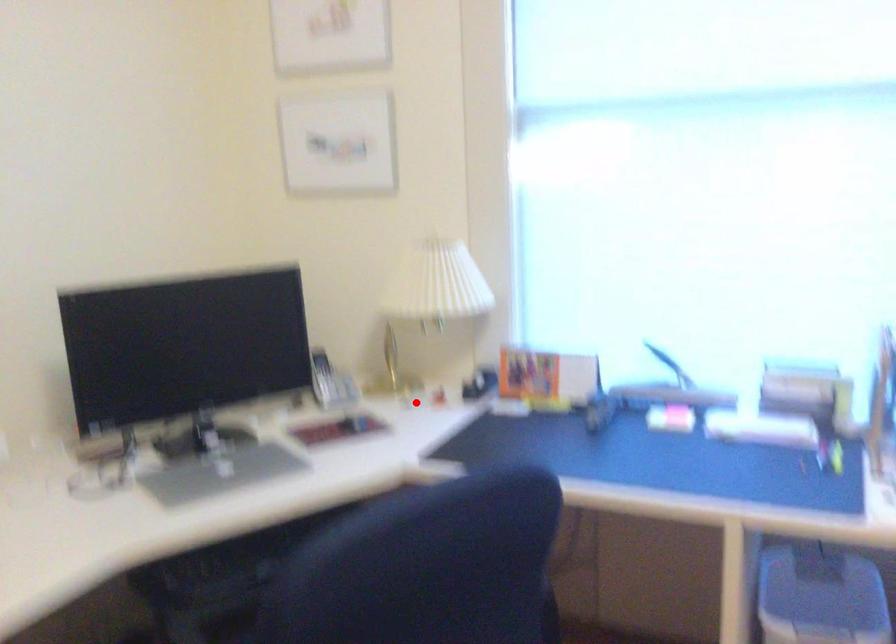
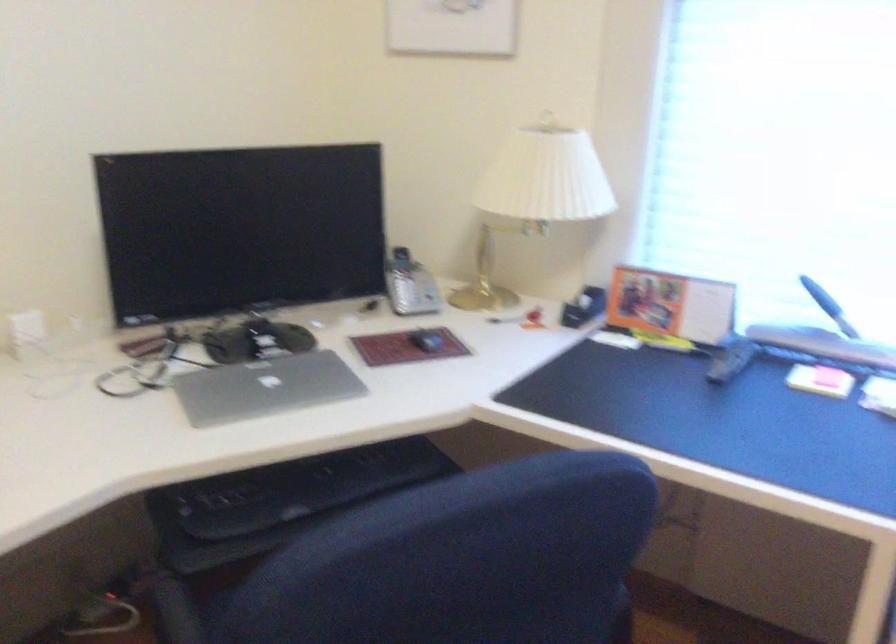
Question: I am providing you with two images of the same scene from different viewpoints. Image1 has a red point marked. In image2, the corresponding 3D location appears at what relative position? Reply with the corresponding letter.

Choices:
 (A) Closer
 (B) Farther

Answer: (A)